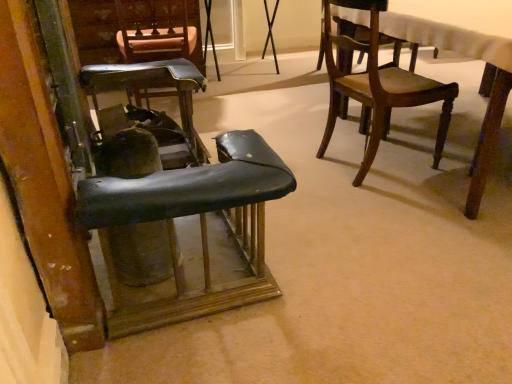
Question: From a real-world perspective, is wooden chair at upper right, the 1th chair from the right, on leather-like black chair at center-left, which ranks as the second chair in left-to-right order?

Choices:
 (A) no
 (B) yes

Answer: (B)

Question: Is leather-like black chair at center-left, which ranks as the second chair in left-to-right order, at the back of wooden chair at upper right, which is the 4th chair from left to right?

Choices:
 (A) no
 (B) yes

Answer: (A)

Question: Is wooden chair at upper right, the 1th chair from the right, aimed at leather-like black chair at center-left, which ranks as the second chair in left-to-right order?

Choices:
 (A) no
 (B) yes

Answer: (A)

Question: Is wooden chair at upper right, which is the 4th chair from left to right, shorter than leather-like black chair at center-left, the 3th chair positioned from the right?

Choices:
 (A) yes
 (B) no

Answer: (B)

Question: Considering the relative positions of wooden chair at upper right, the 1th chair from the right, and leather-like black chair at center-left, which ranks as the second chair in left-to-right order, in the image provided, is wooden chair at upper right, the 1th chair from the right, to the right of leather-like black chair at center-left, which ranks as the second chair in left-to-right order, from the viewer's perspective?

Choices:
 (A) no
 (B) yes

Answer: (B)

Question: Do you think leather-like black chair at center-left, the 3th chair positioned from the right, is within wooden chair at upper right, the 1th chair from the right, or outside of it?

Choices:
 (A) inside
 (B) outside

Answer: (B)

Question: From a real-world perspective, is leather-like black chair at center-left, the 3th chair positioned from the right, above or below wooden chair at upper right, the 1th chair from the right?

Choices:
 (A) above
 (B) below

Answer: (B)

Question: Is leather-like black chair at center-left, which ranks as the second chair in left-to-right order, bigger or smaller than wooden chair at upper right, the 1th chair from the right?

Choices:
 (A) small
 (B) big

Answer: (A)

Question: From the image's perspective, is leather-like black chair at center-left, which ranks as the second chair in left-to-right order, above or below wooden chair at upper right, the 1th chair from the right?

Choices:
 (A) above
 (B) below

Answer: (B)

Question: From the image's perspective, is leather-like black chair at left, the second chair positioned from the right, above or below wooden chair at upper right, the 1th chair from the right?

Choices:
 (A) below
 (B) above

Answer: (A)

Question: Based on their positions, is leather-like black chair at left, the second chair positioned from the right, located to the left or right of wooden chair at upper right, the 1th chair from the right?

Choices:
 (A) left
 (B) right

Answer: (A)

Question: In terms of height, does leather-like black chair at left, which is counted as the third chair, starting from the left, look taller or shorter compared to wooden chair at upper right, which is the 4th chair from left to right?

Choices:
 (A) short
 (B) tall

Answer: (A)

Question: Do you think leather-like black chair at left, which is counted as the third chair, starting from the left, is within wooden chair at upper right, the 1th chair from the right, or outside of it?

Choices:
 (A) inside
 (B) outside

Answer: (B)

Question: Based on their sizes in the image, would you say wooden chair at upper right, which is the 4th chair from left to right, is bigger or smaller than leather-like black chair at center-left, which ranks as the second chair in left-to-right order?

Choices:
 (A) small
 (B) big

Answer: (B)

Question: From the image's perspective, relative to leather-like black chair at center-left, which ranks as the second chair in left-to-right order, is wooden chair at upper right, the 1th chair from the right, above or below?

Choices:
 (A) below
 (B) above

Answer: (B)